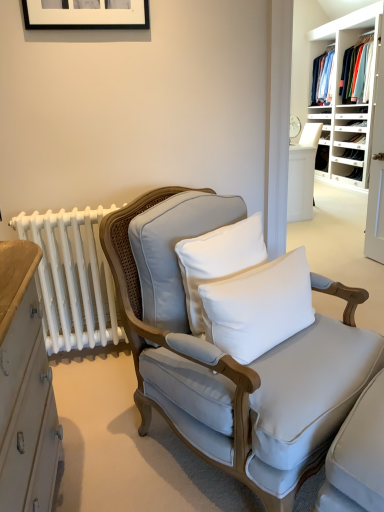
Question: Can you confirm if black matte picture frame at upper center is smaller than white cotton pillow at center, positioned as the 2th pillow in right-to-left order?

Choices:
 (A) yes
 (B) no

Answer: (A)

Question: Is the surface of black matte picture frame at upper center in direct contact with white cotton pillow at center, which appears as the first pillow when viewed from the left?

Choices:
 (A) yes
 (B) no

Answer: (B)

Question: Can you confirm if black matte picture frame at upper center is positioned to the left of white cotton pillow at center, which appears as the first pillow when viewed from the left?

Choices:
 (A) no
 (B) yes

Answer: (B)

Question: From the image's perspective, is black matte picture frame at upper center on top of white cotton pillow at center, positioned as the 2th pillow in right-to-left order?

Choices:
 (A) no
 (B) yes

Answer: (B)

Question: Is there a large distance between black matte picture frame at upper center and white cotton pillow at center, which appears as the first pillow when viewed from the left?

Choices:
 (A) yes
 (B) no

Answer: (A)

Question: From the image's perspective, is black matte picture frame at upper center located beneath white cotton pillow at center, positioned as the 2th pillow in right-to-left order?

Choices:
 (A) no
 (B) yes

Answer: (A)

Question: Considering the relative sizes of white cotton pillow at center, which appears as the first pillow when viewed from the left, and light gray fabric chair at center in the image provided, is white cotton pillow at center, which appears as the first pillow when viewed from the left, taller than light gray fabric chair at center?

Choices:
 (A) yes
 (B) no

Answer: (B)

Question: Is white cotton pillow at center, which appears as the first pillow when viewed from the left, looking in the opposite direction of light gray fabric chair at center?

Choices:
 (A) yes
 (B) no

Answer: (A)

Question: Is white cotton pillow at center, which appears as the first pillow when viewed from the left, placed right next to light gray fabric chair at center?

Choices:
 (A) no
 (B) yes

Answer: (A)

Question: Considering the relative sizes of white cotton pillow at center, positioned as the 2th pillow in right-to-left order, and light gray fabric chair at center in the image provided, is white cotton pillow at center, positioned as the 2th pillow in right-to-left order, shorter than light gray fabric chair at center?

Choices:
 (A) yes
 (B) no

Answer: (A)

Question: Is the position of white cotton pillow at center, positioned as the 2th pillow in right-to-left order, more distant than that of light gray fabric chair at center?

Choices:
 (A) no
 (B) yes

Answer: (B)

Question: From a real-world perspective, is white cotton pillow at center, positioned as the 2th pillow in right-to-left order, physically below light gray fabric chair at center?

Choices:
 (A) no
 (B) yes

Answer: (A)

Question: Does white wood shelves at upper right have a lesser width compared to black matte picture frame at upper center?

Choices:
 (A) yes
 (B) no

Answer: (B)